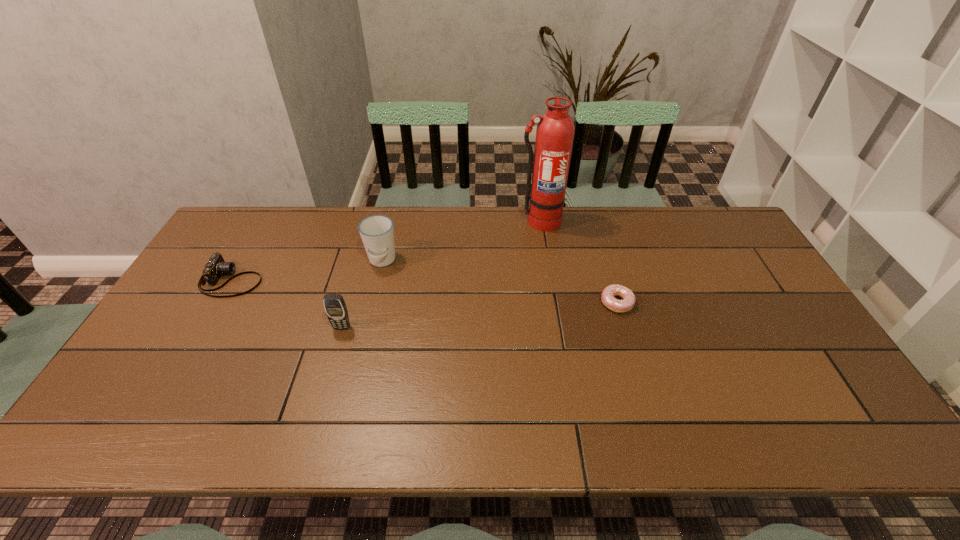
Identify which object is the nearest to the cellular telephone. Please provide its 2D coordinates. Your answer should be formatted as a tuple, i.e. [(x, y)], where the tuple contains the x and y coordinates of a point satisfying the conditions above.

[(377, 232)]

In order to click on vacant space that satisfies the following two spatial constraints: 1. with a handle on the side of the cup; 2. on the front-facing side of the leftmost object in this screenshot , I will do `click(377, 280)`.

Where is `free space that satisfies the following two spatial constraints: 1. on the front-facing side of the doughnut; 2. on the left side of the leftmost object`? free space that satisfies the following two spatial constraints: 1. on the front-facing side of the doughnut; 2. on the left side of the leftmost object is located at coordinates (218, 303).

Image resolution: width=960 pixels, height=540 pixels. I want to click on blank space that satisfies the following two spatial constraints: 1. on the front-facing side of the shortest object; 2. on the right side of the camera, so click(218, 303).

This screenshot has height=540, width=960. Identify the location of vacant space that satisfies the following two spatial constraints: 1. on the label side of the second object from right to left; 2. on the front-facing side of the camera. (549, 280).

The image size is (960, 540). I want to click on free point that satisfies the following two spatial constraints: 1. with a handle on the side of the rightmost object; 2. on the right side of the cup, so [372, 303].